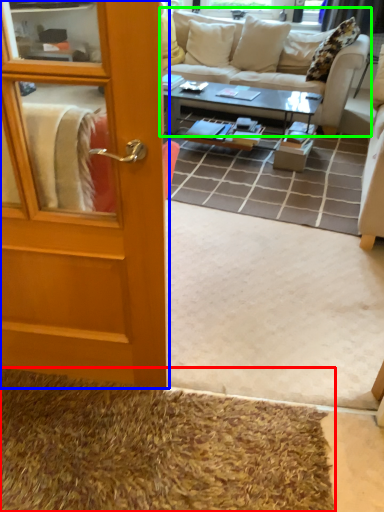
Question: Considering the real-world distances, which object is closest to doormat (highlighted by a red box)? door (highlighted by a blue box) or studio couch (highlighted by a green box).

Choices:
 (A) door
 (B) studio couch

Answer: (A)